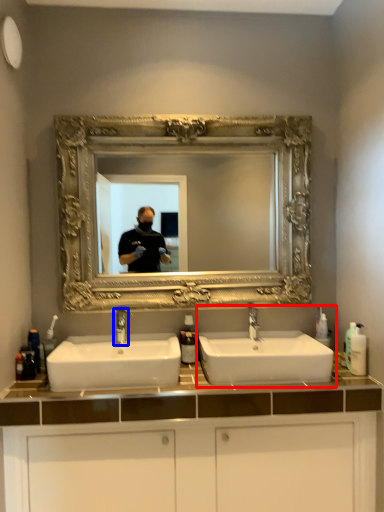
Question: Which point is closer to the camera, sink (highlighted by a red box) or tap (highlighted by a blue box)?

Choices:
 (A) sink
 (B) tap

Answer: (A)